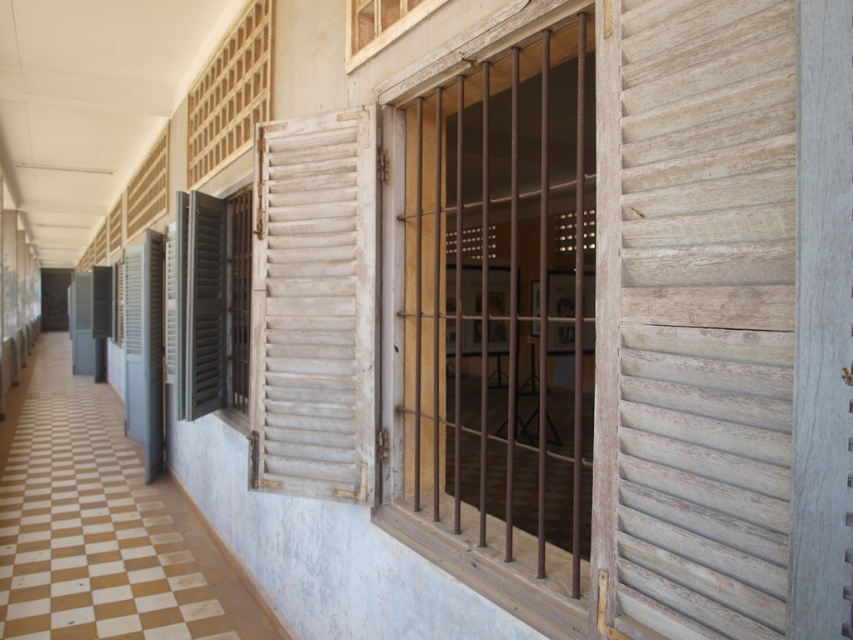
Between brown wooden bars at center and gray matte shutter at left, which one has more height?

brown wooden bars at center

The image size is (853, 640). What do you see at coordinates (496, 316) in the screenshot?
I see `brown wooden bars at center` at bounding box center [496, 316].

Is point (440, 275) farther from camera compared to point (218, 356)?

No, (440, 275) is in front of (218, 356).

Image resolution: width=853 pixels, height=640 pixels. Find the location of `brown wooden bars at center`. brown wooden bars at center is located at coordinates (496, 316).

Is point (488, 257) farther from viewer compared to point (642, 605)?

Yes, it is.

The width and height of the screenshot is (853, 640). What do you see at coordinates (496, 316) in the screenshot?
I see `brown wooden bars at center` at bounding box center [496, 316].

Identify the location of brown wooden bars at center. This screenshot has height=640, width=853. (496, 316).

Does point (772, 314) come closer to viewer compared to point (200, 365)?

Yes, it is in front of point (200, 365).

Does point (688, 352) come in front of point (196, 202)?

That is True.

At what (x,y) coordinates should I click in order to perform the action: click on weathered wood shutter at center. Please return your answer as a coordinate pair (x, y). Looking at the image, I should click on (705, 317).